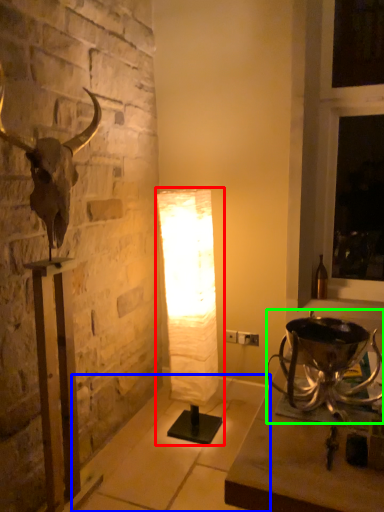
Question: Considering the real-world distances, which object is closest to lamp (highlighted by a red box)? concrete (highlighted by a blue box) or candle holder (highlighted by a green box).

Choices:
 (A) concrete
 (B) candle holder

Answer: (A)